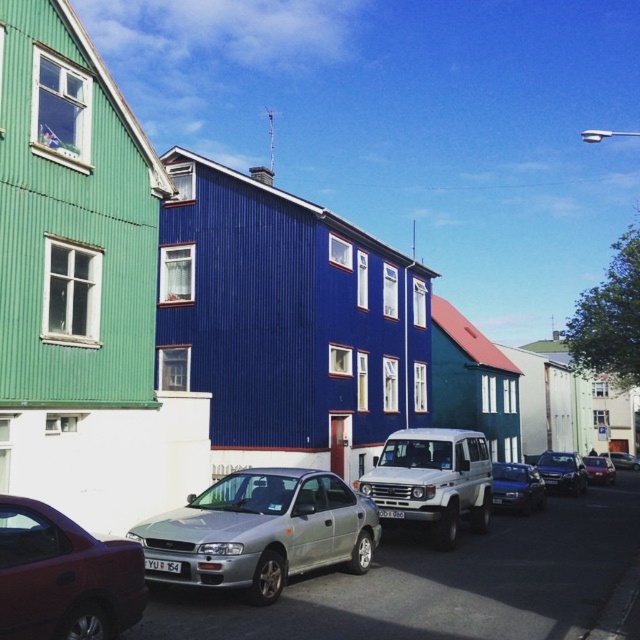
You are a delivery person needing to park your 5 meter long truck between the silver metallic car at center and the metallic blue sedan at center. Can you fit your truck between them without overlapping either vehicle?

The distance between the silver metallic car at center and the metallic blue sedan at center is 11.31 meters. Since your truck is 5 meters long, there is enough space to park it between them without overlapping either vehicle.

You are standing at the origin point of the coordinate system where the street is represented. The silver metallic car at center is located at coordinates 0.831 on the x axis and 0.408 on the y axis. If you want to walk directly towards the car from the origin, which direction should you head? Please state the direction as a cardinal direction like north, south, east, or west, or a combination like northeast.

The silver metallic car at center is located at coordinates 0.831 on the x axis and 0.408 on the y axis. Since the x coordinate is positive and the y coordinate is also positive, you should head northeast to reach the car.

You are standing at the center of the street looking towards the houses. Which direction should you turn to face the shiny red sedan at lower left?

Since the shiny red sedan at lower left is located at coordinates point [64,577], you should turn to your left to face it.